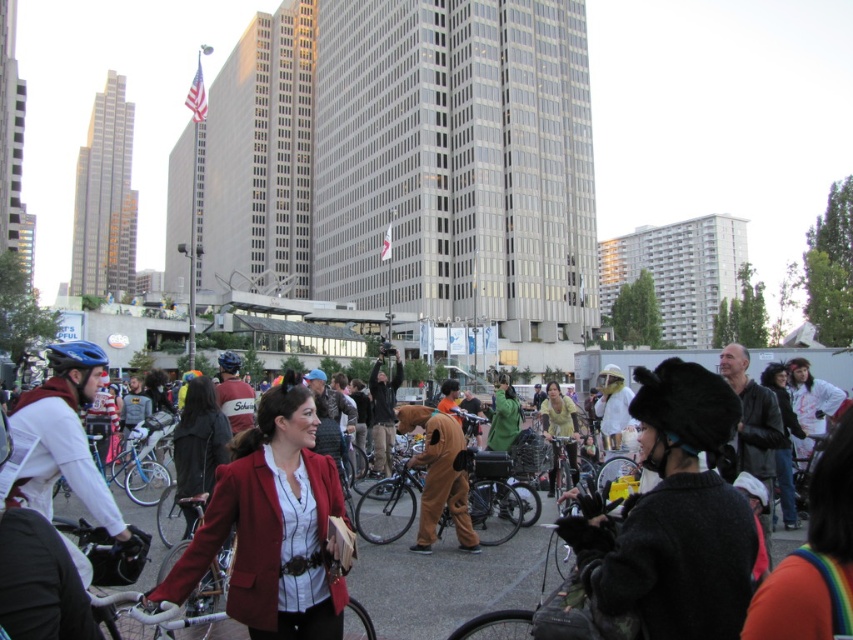
Question: Among these points, which one is farthest from the camera?

Choices:
 (A) (412, 588)
 (B) (67, 365)

Answer: (A)

Question: Can you confirm if silver metallic bicycle at center is wider than blue matte bicycle helmet at center?

Choices:
 (A) yes
 (B) no

Answer: (B)

Question: Which object is closer to the camera taking this photo?

Choices:
 (A) brown fabric bicycle at center
 (B) blue matte bicycle helmet at center
 (C) silver metallic bicycle at center
 (D) red leather jacket at center

Answer: (C)

Question: Is brown fabric bicycle at center smaller than silver metallic bicycle at center?

Choices:
 (A) yes
 (B) no

Answer: (A)

Question: Among these objects, which one is nearest to the camera?

Choices:
 (A) brown furry costume at center
 (B) red leather jacket at center
 (C) brown fabric bicycle at center
 (D) silver metallic bicycle at center

Answer: (D)

Question: Where is brown furry costume at center located in relation to silver metallic bicycle at center in the image?

Choices:
 (A) right
 (B) left

Answer: (A)